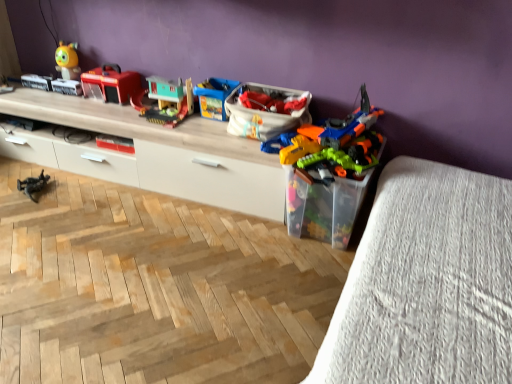
Question: From the image's perspective, relative to blue plastic toy at center, which is the fourth toy from left to right, is metallic gray toy soldier at lower left, the fifth toy in the right-to-left sequence, above or below?

Choices:
 (A) below
 (B) above

Answer: (A)

Question: In terms of height, does metallic gray toy soldier at lower left, the fifth toy in the right-to-left sequence, look taller or shorter compared to blue plastic toy at center, which is the fourth toy from left to right?

Choices:
 (A) short
 (B) tall

Answer: (A)

Question: Which of these objects is positioned closest to the shiny red fire truck at center, the 4th toy when ordered from right to left?

Choices:
 (A) translucent plastic toy guns at right, the 5th toy positioned from the left
 (B) wooden at upper left
 (C) metallic gray toy soldier at lower left, the fifth toy in the right-to-left sequence
 (D) translucent plastic storage box at center-right, acting as the 1th storage box starting from the bottom
 (E) white fabric bag at center, positioned as the 1th storage box in top-to-bottom order

Answer: (B)

Question: Estimate the real-world distances between objects in this image. Which object is farther from the translucent plastic toy guns at right, the 5th toy positioned from the left?

Choices:
 (A) white fabric bag at center, positioned as the 1th storage box in top-to-bottom order
 (B) blue plastic toy at center, which is counted as the 2th toy, starting from the right
 (C) wooden at upper left
 (D) wooden toy house at center, which is the 3th toy in right-to-left order
 (E) translucent plastic storage box at center-right, acting as the 1th storage box starting from the bottom

Answer: (D)